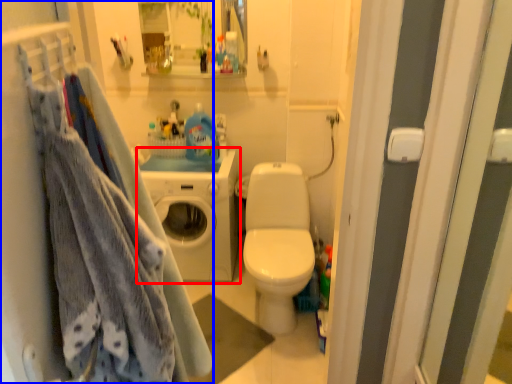
Question: Among these objects, which one is nearest to the camera, washing machine (highlighted by a red box) or closet (highlighted by a blue box)?

Choices:
 (A) washing machine
 (B) closet

Answer: (B)